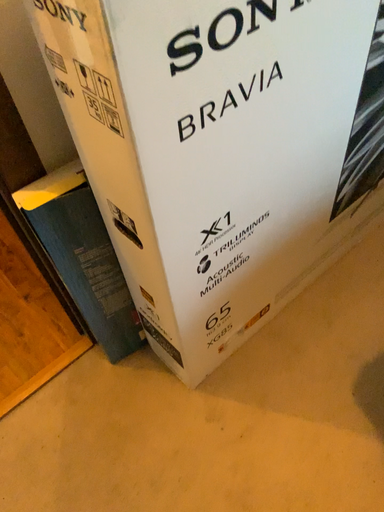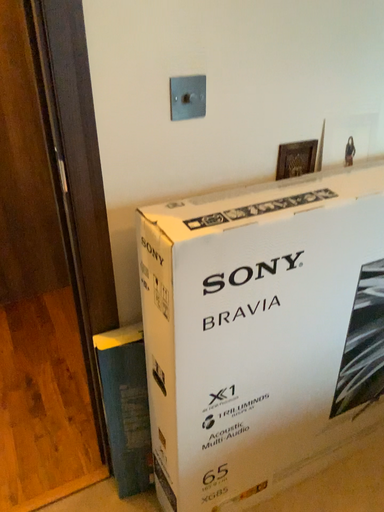
Question: Which way did the camera rotate in the video?

Choices:
 (A) rotated upward
 (B) rotated downward

Answer: (A)